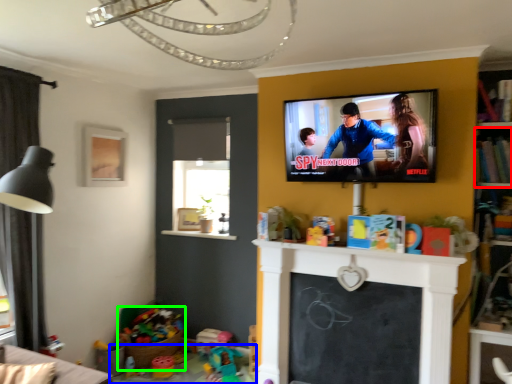
Question: Which object is the closest to the shelf (highlighted by a red box)? Choose among these: table (highlighted by a blue box) or toy (highlighted by a green box).

Choices:
 (A) table
 (B) toy

Answer: (A)